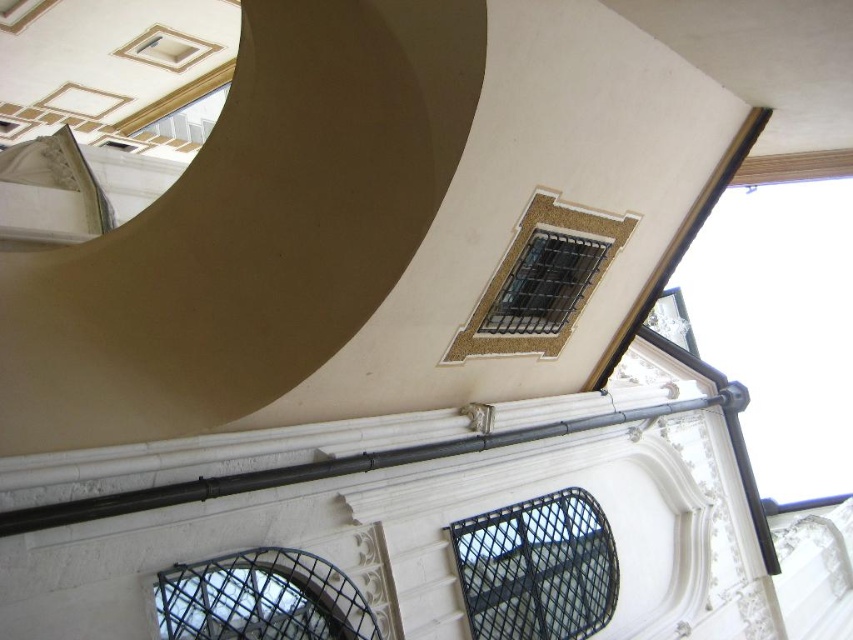
You are standing in the historical building and want to take a photo of both the gold mosaic window at upper center and the black metal grid at lower left. Can you capture both in a single frame without moving your camera? Please explain your reasoning based on their distance.

The gold mosaic window at upper center is 7.01 meters away from the black metal grid at lower left. Since the distance between them is significant, it might be challenging to capture both in a single frame without moving the camera. However, using a wide angle lens could potentially include both elements in the shot.

You are an architect examining the ceiling of a historical building. You notice two points marked on the ceiling. The first point is at coordinates point (x=555, y=349) and the second is at point (x=259, y=628). Which of these two points is closer to you as you look up at the ceiling?

Point (x=555, y=349) is closer to you than point (x=259, y=628) because it is further to the viewer.

You are an architect designing a new building and want to place a decorative element exactly where the black mesh window at upper center is located. According to the image, what are the coordinates of this position?

The coordinates of the black mesh window at upper center are at point [537,568].